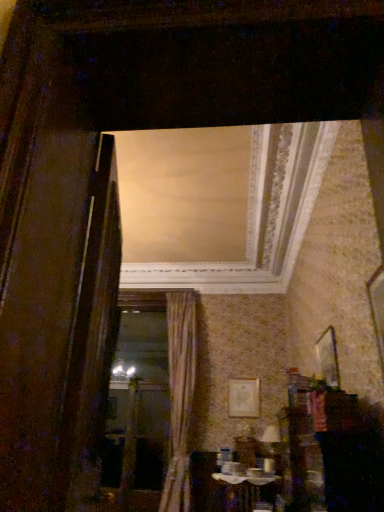
Question: Is wooden picture frame at upper right, the first picture frame when ordered from front to back, positioned beyond the bounds of matte gold picture frame at center, which is the first picture frame in back-to-front order?

Choices:
 (A) yes
 (B) no

Answer: (A)

Question: Does wooden picture frame at upper right, which ranks as the 1th picture frame in top-to-bottom order, have a greater height compared to matte gold picture frame at center, the second picture frame positioned from the right?

Choices:
 (A) no
 (B) yes

Answer: (A)

Question: Considering the relative sizes of wooden picture frame at upper right, marked as the 2th picture frame in a back-to-front arrangement, and matte gold picture frame at center, marked as the first picture frame in a left-to-right arrangement, in the image provided, is wooden picture frame at upper right, marked as the 2th picture frame in a back-to-front arrangement, shorter than matte gold picture frame at center, marked as the first picture frame in a left-to-right arrangement,?

Choices:
 (A) no
 (B) yes

Answer: (B)

Question: Does wooden picture frame at upper right, marked as the 1th picture frame in a right-to-left arrangement, have a larger size compared to matte gold picture frame at center, which ranks as the first picture frame in bottom-to-top order?

Choices:
 (A) no
 (B) yes

Answer: (B)

Question: Is wooden picture frame at upper right, which ranks as the 1th picture frame in top-to-bottom order, thinner than matte gold picture frame at center, which is the 2th picture frame in top-to-bottom order?

Choices:
 (A) no
 (B) yes

Answer: (A)

Question: Would you say gold textured curtain at center is to the left or to the right of wooden table at lower center in the picture?

Choices:
 (A) left
 (B) right

Answer: (A)

Question: Relative to wooden table at lower center, is gold textured curtain at center in front or behind?

Choices:
 (A) behind
 (B) front

Answer: (A)

Question: Considering the positions of gold textured curtain at center and wooden table at lower center in the image, is gold textured curtain at center bigger or smaller than wooden table at lower center?

Choices:
 (A) big
 (B) small

Answer: (A)

Question: Is point (180, 337) positioned closer to the camera than point (271, 504)?

Choices:
 (A) farther
 (B) closer

Answer: (A)

Question: From a real-world perspective, relative to matte gold picture frame at center, which is the first picture frame in back-to-front order, is gold textured curtain at center vertically above or below?

Choices:
 (A) below
 (B) above

Answer: (B)

Question: Considering the positions of gold textured curtain at center and matte gold picture frame at center, the 2th picture frame viewed from the front, in the image, is gold textured curtain at center wider or thinner than matte gold picture frame at center, the 2th picture frame viewed from the front,?

Choices:
 (A) wide
 (B) thin

Answer: (A)

Question: Is gold textured curtain at center spatially inside matte gold picture frame at center, which is the first picture frame in back-to-front order, or outside of it?

Choices:
 (A) outside
 (B) inside

Answer: (A)

Question: In the image, is gold textured curtain at center on the left side or the right side of matte gold picture frame at center, which is the 2th picture frame in top-to-bottom order?

Choices:
 (A) right
 (B) left

Answer: (B)

Question: From a real-world perspective, is gold textured curtain at center physically located above or below wooden frame at center?

Choices:
 (A) above
 (B) below

Answer: (A)

Question: Considering the positions of gold textured curtain at center and wooden frame at center in the image, is gold textured curtain at center taller or shorter than wooden frame at center?

Choices:
 (A) short
 (B) tall

Answer: (B)